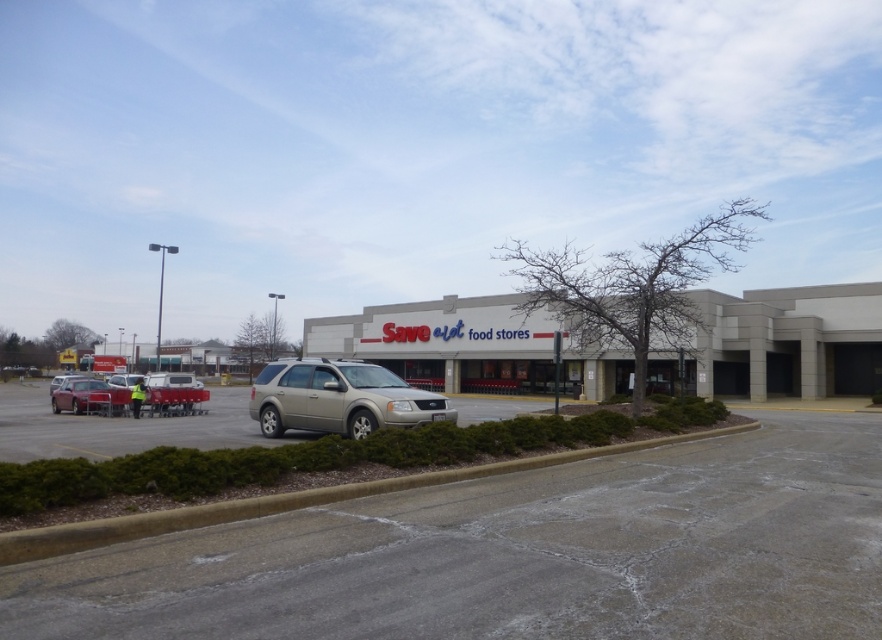
You are a delivery driver approaching the Save A Lot food stores. You need to park your truck, which is 3 meters long, in the parking lot. The parking spot you want is between the metallic silver suv at center and the concrete at lower center. Can your truck fit there?

The metallic silver suv at center is further to the viewer than concrete at lower center, so the space between them is at least 3 meters. Therefore, the truck can fit in the parking spot between the metallic silver suv at center and the concrete at lower center.

You are a delivery driver who needs to unload a tall package from your truck. The package is 2 meters tall. You see the metallic silver suv at center and the concrete at lower center. Which location would be safer to place the package to avoid it hitting any vehicles?

The concrete at lower center is safer because the metallic silver suv at center is taller than the concrete at lower center, so placing the package there would be less likely to hit the SUV.

You are standing at the entrance of the Save A Lot food stores and want to find the metallic silver suv at center parked in the parking lot. According to the coordinates provided, where should you look to find it?

The metallic silver suv at center is located at point (121, 428), which means it is positioned towards the lower right area of the parking lot.